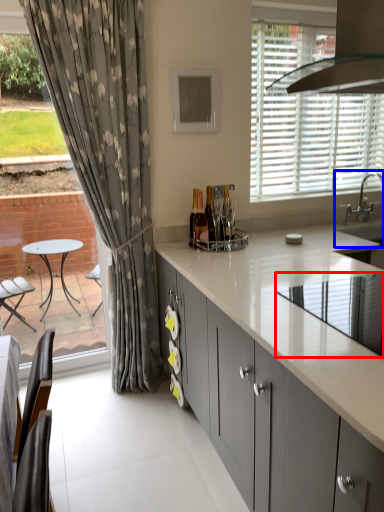
Question: Which object is closer to the camera taking this photo, appliance (highlighted by a red box) or sink (highlighted by a blue box)?

Choices:
 (A) appliance
 (B) sink

Answer: (A)